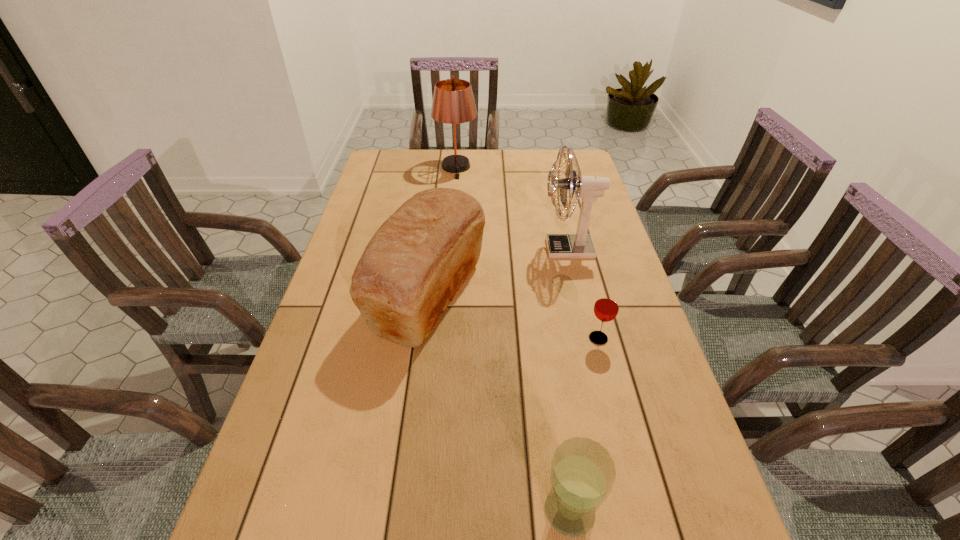
The image size is (960, 540). Find the location of `free spot between the third shortest object and the shorter glass`. free spot between the third shortest object and the shorter glass is located at coordinates (514, 317).

Where is `vacant region between the farther glass and the third tallest object`? This screenshot has width=960, height=540. vacant region between the farther glass and the third tallest object is located at coordinates (514, 317).

Identify the location of free space between the fan and the bread. The height and width of the screenshot is (540, 960). (498, 272).

The image size is (960, 540). In order to click on unoccupied area between the right glass and the bread in this screenshot , I will do `click(514, 317)`.

Find the location of a particular element. This screenshot has width=960, height=540. unoccupied area between the shortest object and the fan is located at coordinates (584, 294).

Select which object is the fourth closest to the shortest object. Please provide its 2D coordinates. Your answer should be formatted as a tuple, i.e. [(x, y)], where the tuple contains the x and y coordinates of a point satisfying the conditions above.

[(453, 102)]

Locate an element on the screen. The height and width of the screenshot is (540, 960). the fourth closest object to the bread is located at coordinates (453, 102).

The height and width of the screenshot is (540, 960). What are the coordinates of `vacant space that satisfies the following two spatial constraints: 1. on the front-facing side of the lampshade; 2. on the right side of the farther glass` in the screenshot? It's located at (442, 339).